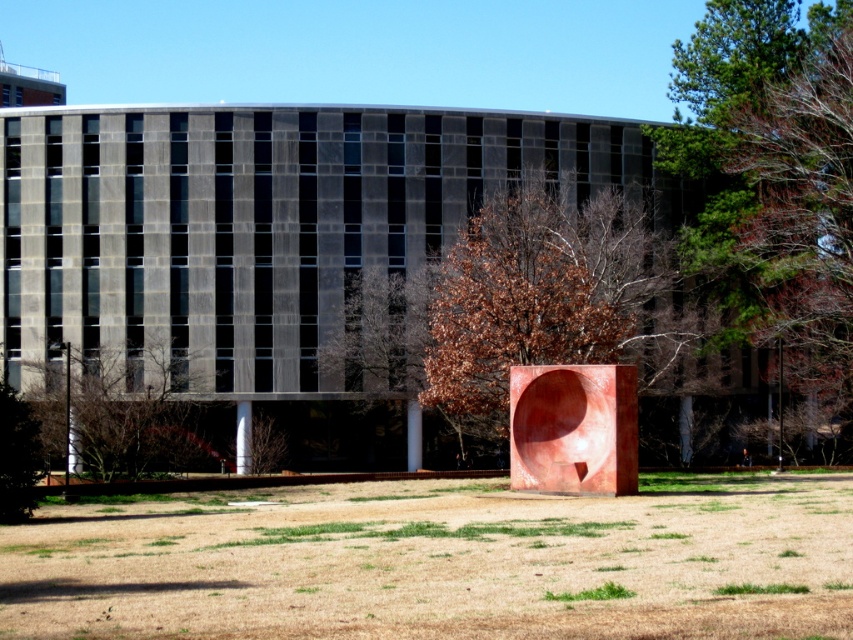
Does brown matte tree at center have a larger size compared to brown leafy tree at lower left?

Correct, brown matte tree at center is larger in size than brown leafy tree at lower left.

From the picture: Can you confirm if brown matte tree at center is positioned below brown leafy tree at lower left?

No, brown matte tree at center is not below brown leafy tree at lower left.

Identify the location of brown matte tree at center. tap(548, 298).

The width and height of the screenshot is (853, 640). What are the coordinates of `brown matte tree at center` in the screenshot? It's located at (548, 298).

Is point (805, 195) closer to viewer compared to point (158, 442)?

No, it is behind (158, 442).

Can you confirm if brown leafy tree at upper right is bigger than brown leafy tree at lower left?

Incorrect, brown leafy tree at upper right is not larger than brown leafy tree at lower left.

Which is in front, point (816, 86) or point (148, 464)?

Point (148, 464) is in front.

Where is `brown leafy tree at upper right`? This screenshot has width=853, height=640. brown leafy tree at upper right is located at coordinates (804, 220).

Who is more distant from viewer, (x=576, y=324) or (x=610, y=596)?

The point (x=576, y=324) is more distant.

Between brown matte tree at center and green grass at lower center, which one is positioned higher?

brown matte tree at center

Does point (595, 260) lie in front of point (548, 593)?

No, (595, 260) is further to viewer.

You are a GUI agent. You are given a task and a screenshot of the screen. Output one action in this format:
    pyautogui.click(x=<x>, y=<y>)
    Task: Click on the brown matte tree at center
    The height and width of the screenshot is (640, 853).
    Given the screenshot: What is the action you would take?
    pyautogui.click(x=548, y=298)